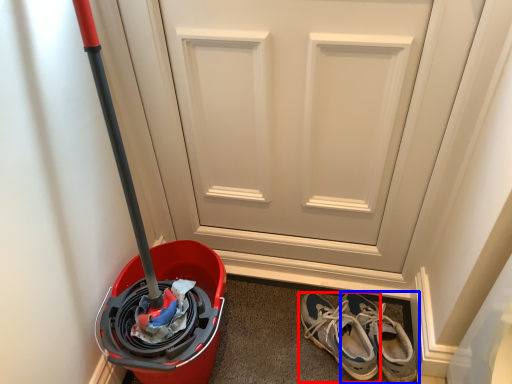
Question: Which of the following is the farthest to the observer, footwear (highlighted by a red box) or footwear (highlighted by a blue box)?

Choices:
 (A) footwear
 (B) footwear

Answer: (B)